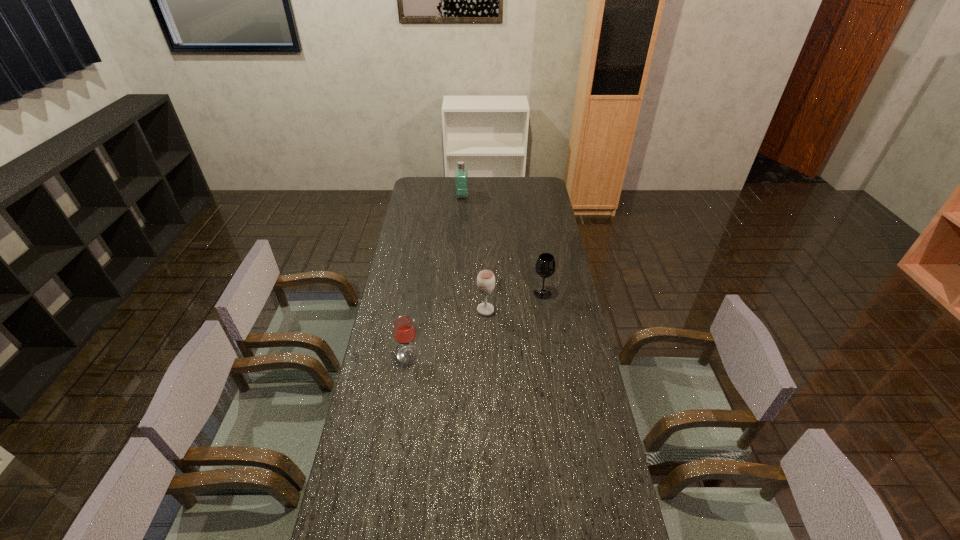
This screenshot has height=540, width=960. Identify the location of the farthest object. (461, 172).

This screenshot has width=960, height=540. Identify the location of perfume. (461, 172).

Image resolution: width=960 pixels, height=540 pixels. I want to click on the third nearest object, so click(x=545, y=266).

This screenshot has height=540, width=960. I want to click on the rightmost object, so click(545, 266).

I want to click on the second wineglass from left to right, so click(x=485, y=280).

Find the location of a particular element. The width and height of the screenshot is (960, 540). the second farthest wineglass is located at coordinates (485, 280).

You are a GUI agent. You are given a task and a screenshot of the screen. Output one action in this format:
    pyautogui.click(x=<x>, y=<y>)
    Task: Click on the leftmost wineglass
    Image resolution: width=960 pixels, height=540 pixels.
    Given the screenshot: What is the action you would take?
    pyautogui.click(x=404, y=329)

Image resolution: width=960 pixels, height=540 pixels. I want to click on the nearest object, so click(x=404, y=329).

The width and height of the screenshot is (960, 540). In order to click on vacant space situated on the front label of the perfume in this screenshot , I will do `click(485, 195)`.

Where is `vacant space located on the back of the rightmost object`? The image size is (960, 540). vacant space located on the back of the rightmost object is located at coordinates (539, 267).